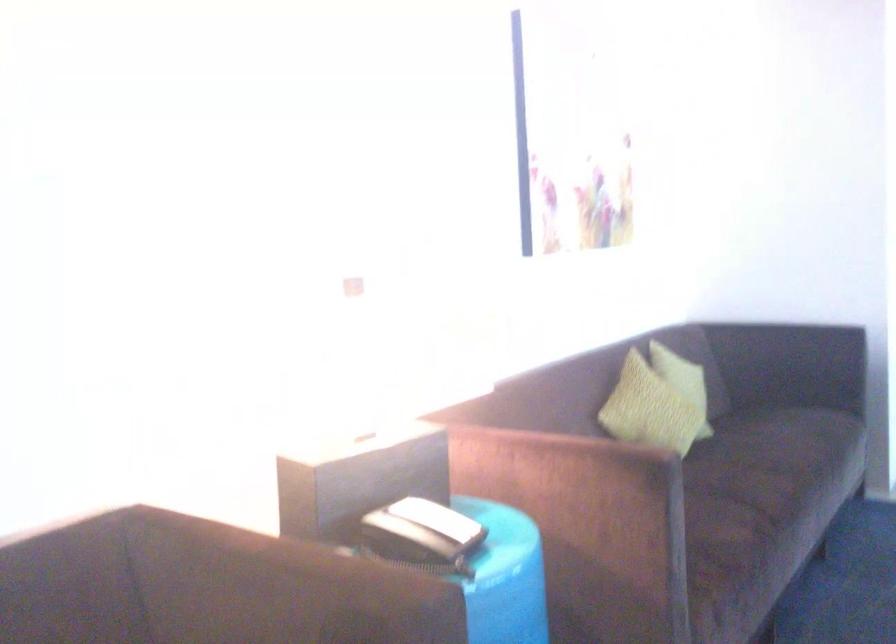
The image size is (896, 644). Describe the element at coordinates (418, 531) in the screenshot. I see `the telephone handset` at that location.